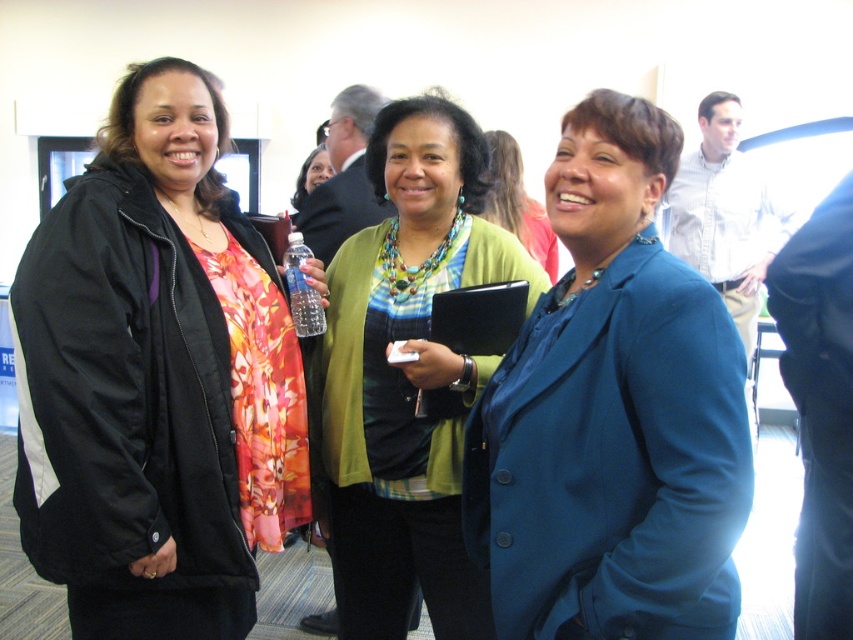
Question: Observing the image, what is the correct spatial positioning of teal smooth blazer at center in reference to matte green sweater at center?

Choices:
 (A) right
 (B) left

Answer: (A)

Question: Considering the real-world distances, which object is farthest from the matte black jacket at left?

Choices:
 (A) green textured cardigan at center
 (B) teal smooth blazer at center
 (C) matte green sweater at center

Answer: (C)

Question: Is matte black jacket at left below matte green sweater at center?

Choices:
 (A) no
 (B) yes

Answer: (B)

Question: Which is farther from the teal smooth blazer at center?

Choices:
 (A) green textured cardigan at center
 (B) matte green sweater at center

Answer: (B)

Question: Which point is closer to the camera taking this photo?

Choices:
 (A) (614, 314)
 (B) (302, 310)
 (C) (264, 413)

Answer: (A)

Question: Can you confirm if matte black jacket at left is thinner than green textured cardigan at center?

Choices:
 (A) yes
 (B) no

Answer: (B)